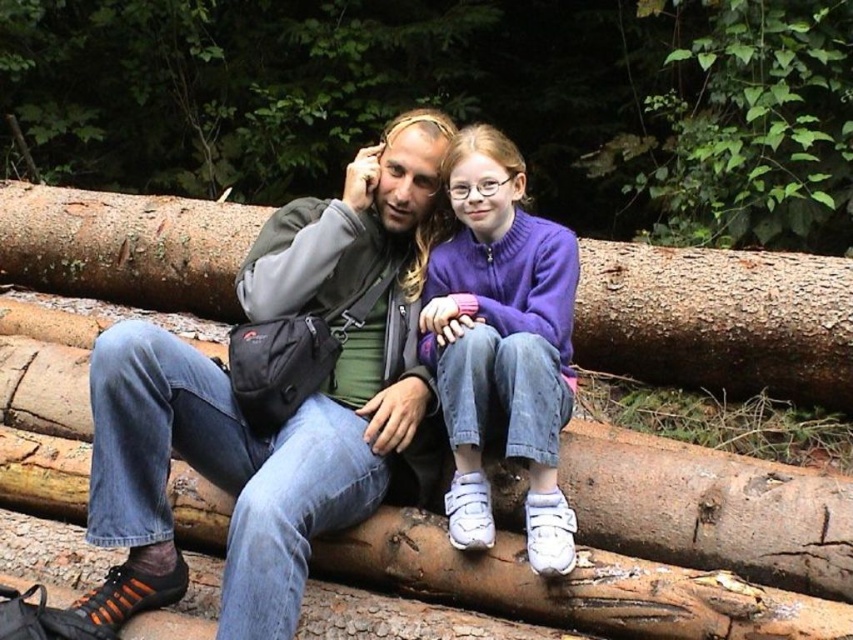
Question: Which point is farther to the camera?

Choices:
 (A) brown rough log at center
 (B) purple fleece sweater at center
 (C) denim jeans at center

Answer: (A)

Question: Can you confirm if brown rough log at center is smaller than purple fleece sweater at center?

Choices:
 (A) yes
 (B) no

Answer: (B)

Question: Can you confirm if denim jeans at center is wider than purple fleece sweater at center?

Choices:
 (A) no
 (B) yes

Answer: (B)

Question: Among these objects, which one is farthest from the camera?

Choices:
 (A) denim jeans at center
 (B) purple fleece sweater at center

Answer: (B)

Question: Considering the relative positions of denim jeans at center and purple fleece sweater at center in the image provided, where is denim jeans at center located with respect to purple fleece sweater at center?

Choices:
 (A) left
 (B) right

Answer: (A)

Question: Based on their relative distances, which object is nearer to the denim jeans at center?

Choices:
 (A) brown rough log at center
 (B) purple fleece sweater at center

Answer: (B)